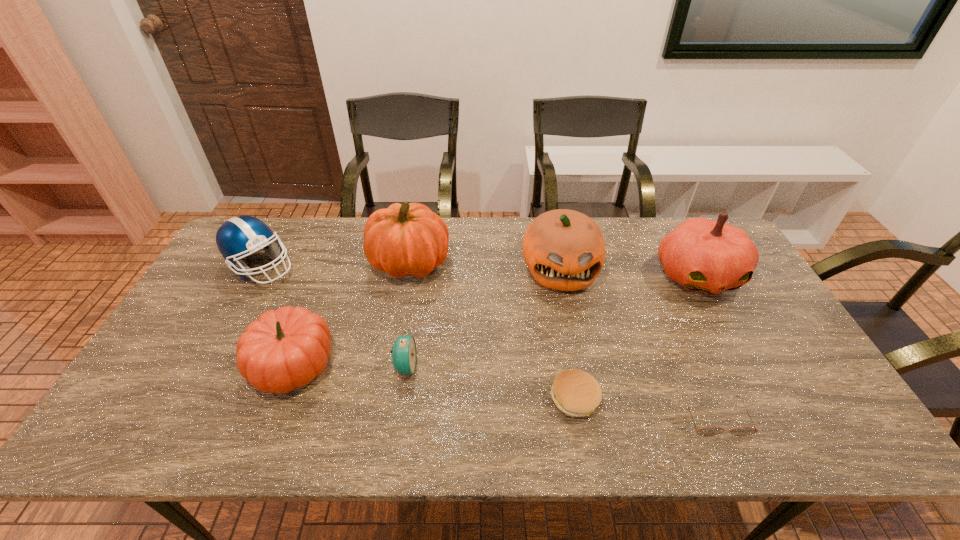
This screenshot has height=540, width=960. What are the coordinates of `empty space that is in between the rightmost pumpkin and the nearest pumpkin` in the screenshot? It's located at (495, 319).

The height and width of the screenshot is (540, 960). I want to click on free space between the rightmost pumpkin and the alarm clock, so click(552, 321).

Locate an element on the screen. The height and width of the screenshot is (540, 960). vacant space that's between the shortest pumpkin and the rightmost pumpkin is located at coordinates (495, 319).

Identify the location of free space between the second pumpkin from left to right and the shortest object. (563, 340).

Identify the location of free space that is in between the third pumpkin from left to right and the sixth tallest object. The width and height of the screenshot is (960, 540). (482, 318).

Identify which object is located as the fifth nearest to the third pumpkin from right to left. Please provide its 2D coordinates. Your answer should be formatted as a tuple, i.e. [(x, y)], where the tuple contains the x and y coordinates of a point satisfying the conditions above.

[(576, 393)]

I want to click on the seventh closest object to the third shortest object, so 703,255.

Select which pumpkin appears as the fourth closest to the football helmet. Please provide its 2D coordinates. Your answer should be formatted as a tuple, i.e. [(x, y)], where the tuple contains the x and y coordinates of a point satisfying the conditions above.

[(703, 255)]

Choose which pumpkin is the third nearest neighbor to the patty. Please provide its 2D coordinates. Your answer should be formatted as a tuple, i.e. [(x, y)], where the tuple contains the x and y coordinates of a point satisfying the conditions above.

[(405, 239)]

Image resolution: width=960 pixels, height=540 pixels. I want to click on vacant area that satisfies the following two spatial constraints: 1. on the face of the second pumpkin from right to left; 2. on the front-facing side of the sixth tallest object, so (579, 367).